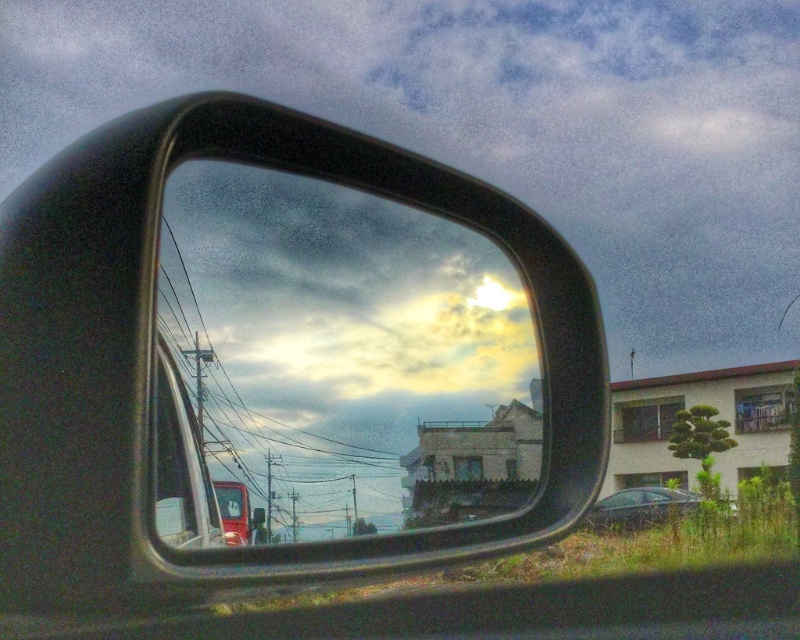
Question: Is clear glass window at center smaller than shiny black sedan at lower right?

Choices:
 (A) no
 (B) yes

Answer: (B)

Question: Which point is farther to the camera?

Choices:
 (A) (608, 524)
 (B) (350, 198)
 (C) (210, 524)

Answer: (A)

Question: Is transparent glass mirror at center bigger than shiny black sedan at lower right?

Choices:
 (A) no
 (B) yes

Answer: (A)

Question: Which of these objects is positioned closest to the clear glass window at center?

Choices:
 (A) shiny black sedan at lower right
 (B) transparent glass mirror at center

Answer: (B)

Question: Which point is closer to the camera?

Choices:
 (A) (156, 385)
 (B) (460, 316)

Answer: (A)

Question: Is transparent glass mirror at center closer to camera compared to shiny black sedan at lower right?

Choices:
 (A) yes
 (B) no

Answer: (A)